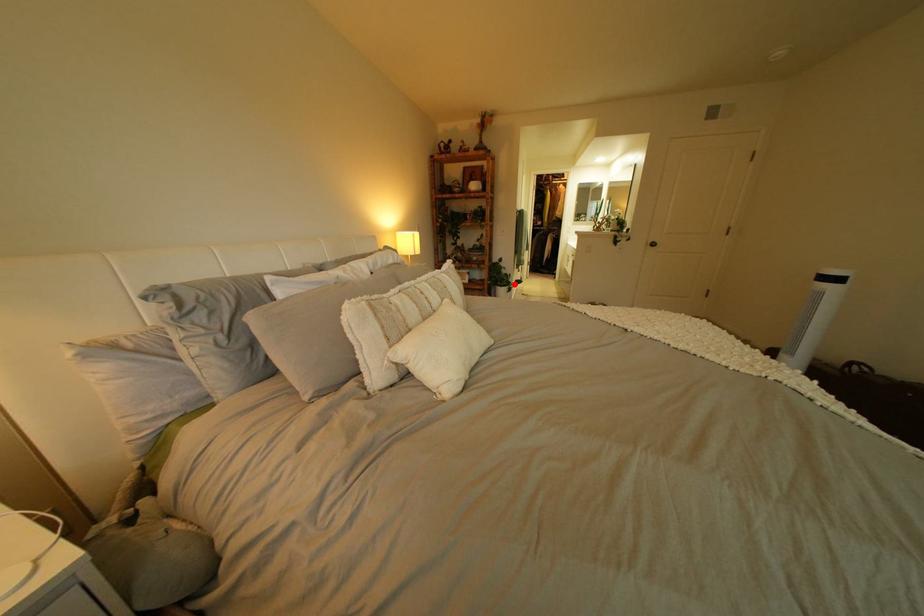
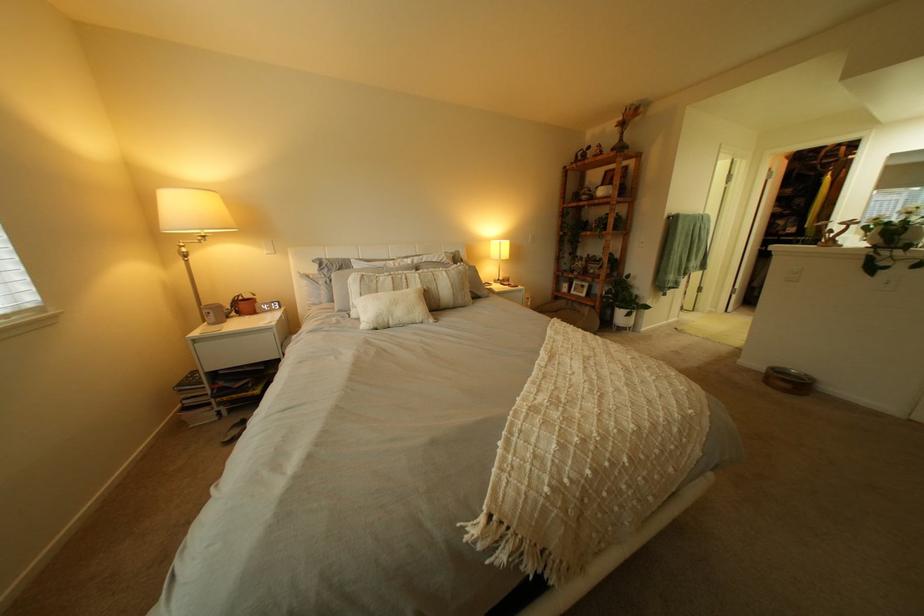
Where in the second image is the point corresponding to the highlighted location from the first image?

(633, 305)